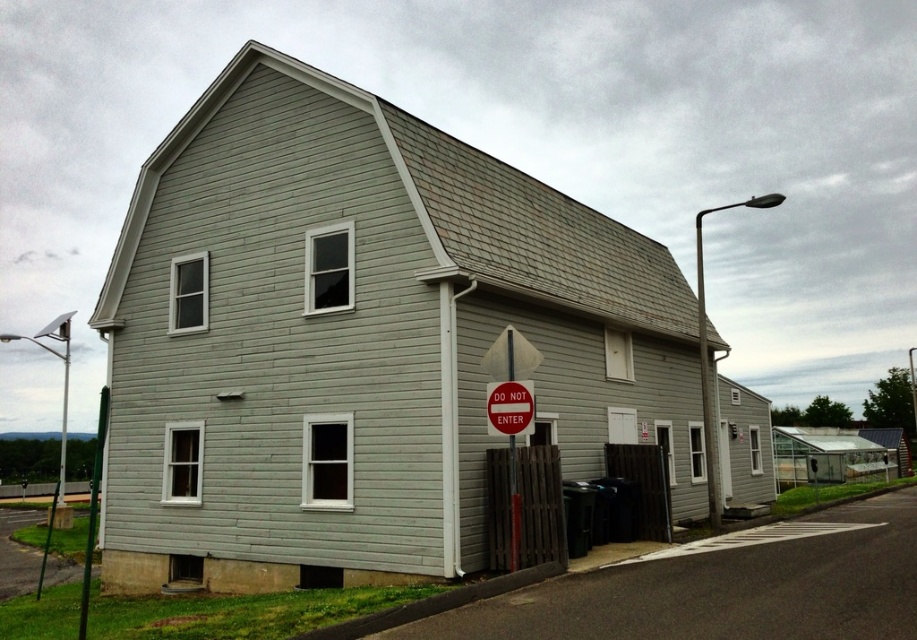
Question: Can you confirm if red plastic sign at lower center is wider than red plastic sign at center?

Choices:
 (A) yes
 (B) no

Answer: (A)

Question: Estimate the real-world distances between objects in this image. Which object is farther from the metallic pole at left?

Choices:
 (A) red plastic sign at lower center
 (B) smooth gray siding at center
 (C) red plastic sign at center

Answer: (A)

Question: Which point is farther from the camera taking this photo?

Choices:
 (A) (x=509, y=481)
 (B) (x=53, y=508)
 (C) (x=529, y=406)

Answer: (B)

Question: Is red plastic sign at lower center above metallic pole at left?

Choices:
 (A) no
 (B) yes

Answer: (B)

Question: Which object is positioned closest to the red plastic sign at lower center?

Choices:
 (A) metallic pole at left
 (B) red plastic sign at center

Answer: (B)

Question: Can you confirm if smooth gray siding at center is positioned to the right of red plastic sign at lower center?

Choices:
 (A) no
 (B) yes

Answer: (B)